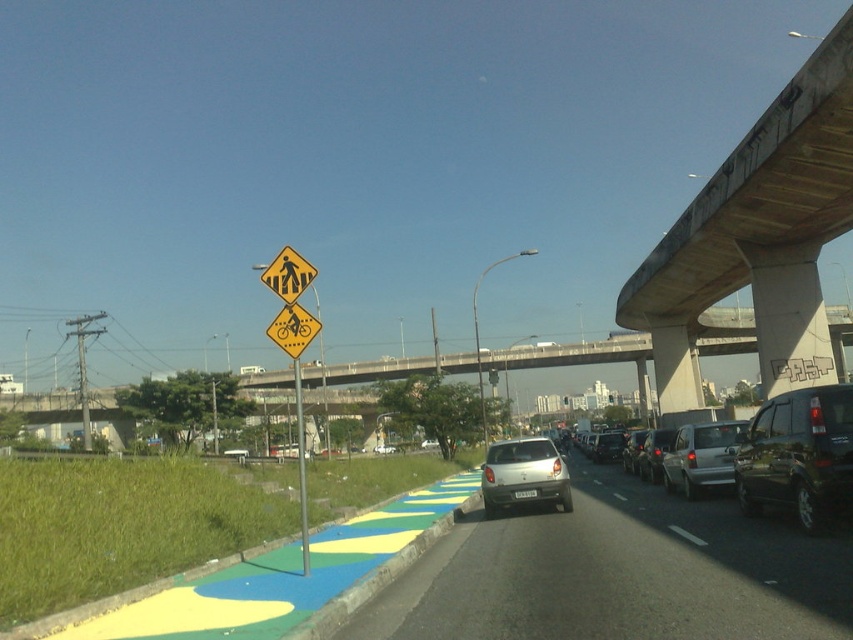
You are a delivery driver needing to park your 4.20 meter long truck between the silver metallic car at center and the satin silver car at center. Can you fit your truck between them without overlapping either car?

The silver metallic car at center and the satin silver car at center are 3.80 meters apart. Since your truck is 4.20 meters long, it cannot fit between them without overlapping either car.